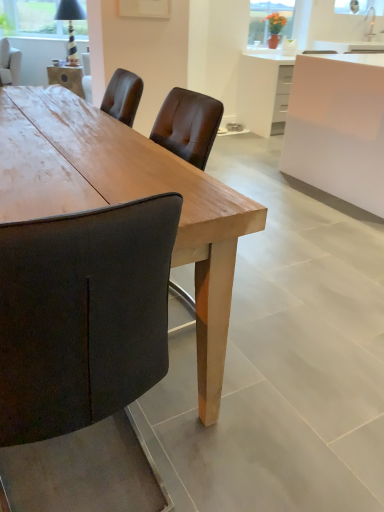
Question: Is white glossy cabinet at upper right in front of matte glass vase at upper center?

Choices:
 (A) no
 (B) yes

Answer: (B)

Question: Could matte glass vase at upper center be considered to be inside white glossy cabinet at upper right?

Choices:
 (A) no
 (B) yes

Answer: (A)

Question: Is white glossy cabinet at upper right further to camera compared to matte glass vase at upper center?

Choices:
 (A) no
 (B) yes

Answer: (A)

Question: Can you confirm if white glossy cabinet at upper right is bigger than matte glass vase at upper center?

Choices:
 (A) yes
 (B) no

Answer: (A)

Question: From a real-world perspective, is white glossy cabinet at upper right beneath matte glass vase at upper center?

Choices:
 (A) yes
 (B) no

Answer: (A)

Question: Is wooden table at center in front of or behind white glossy cabinet at upper right in the image?

Choices:
 (A) behind
 (B) front

Answer: (B)

Question: From the image's perspective, is wooden table at center positioned above or below white glossy cabinet at upper right?

Choices:
 (A) above
 (B) below

Answer: (B)

Question: In terms of height, does wooden table at center look taller or shorter compared to white glossy cabinet at upper right?

Choices:
 (A) short
 (B) tall

Answer: (A)

Question: Visually, is wooden table at center positioned to the left or to the right of white glossy cabinet at upper right?

Choices:
 (A) left
 (B) right

Answer: (A)

Question: Is white glossy cabinet at upper right situated inside dark brown leather chair at upper left or outside?

Choices:
 (A) outside
 (B) inside

Answer: (A)

Question: Considering their positions, is white glossy cabinet at upper right located in front of or behind dark brown leather chair at upper left?

Choices:
 (A) behind
 (B) front

Answer: (B)

Question: Would you say white glossy cabinet at upper right is to the left or to the right of dark brown leather chair at upper left in the picture?

Choices:
 (A) left
 (B) right

Answer: (B)

Question: From a real-world perspective, is white glossy cabinet at upper right positioned above or below dark brown leather chair at upper left?

Choices:
 (A) below
 (B) above

Answer: (A)

Question: In terms of width, does white glossy cabinet at upper right look wider or thinner when compared to white glossy cabinet at upper right?

Choices:
 (A) wide
 (B) thin

Answer: (B)

Question: In terms of height, does white glossy cabinet at upper right look taller or shorter compared to white glossy cabinet at upper right?

Choices:
 (A) tall
 (B) short

Answer: (B)